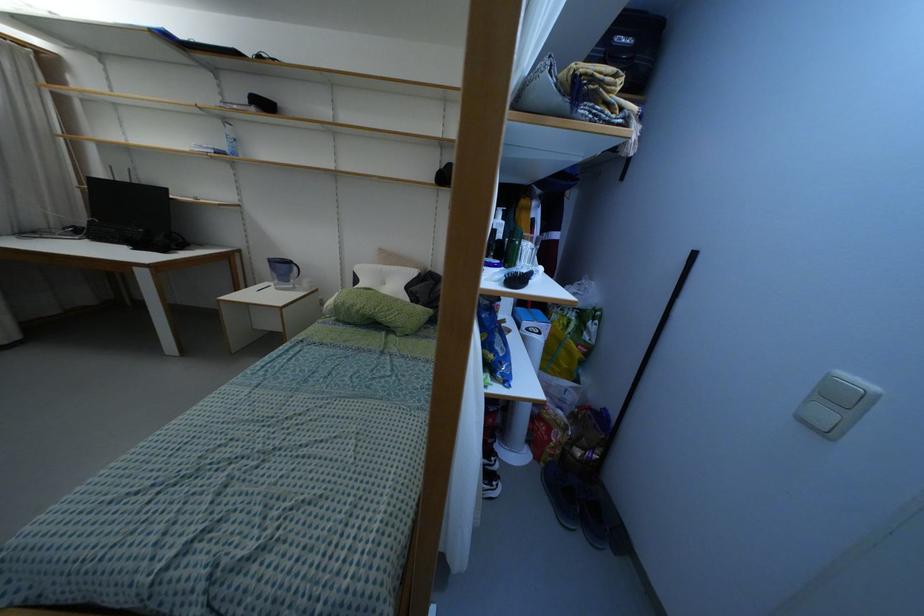
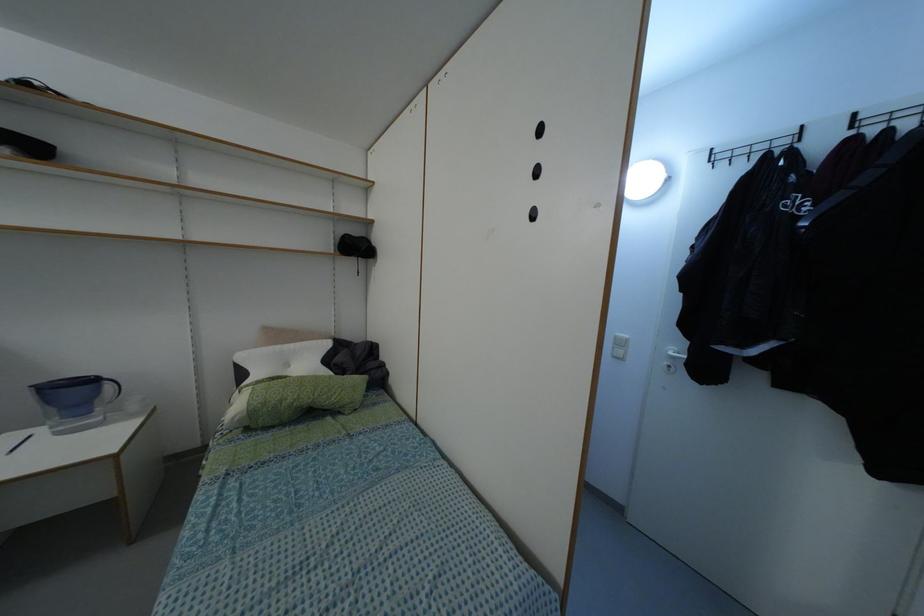
Question: How did the camera likely rotate?

Choices:
 (A) Left
 (B) Right
 (C) Up
 (D) Down

Answer: (B)